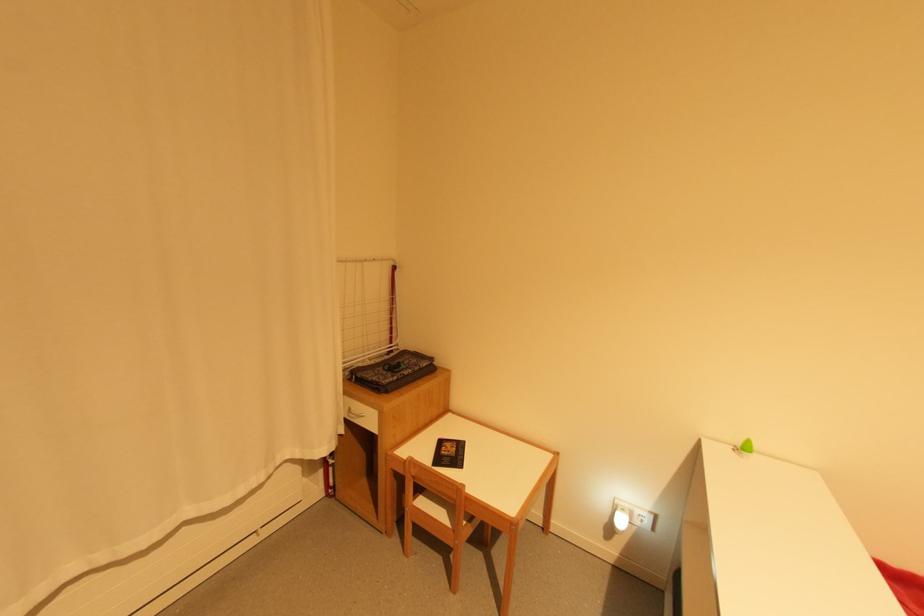
Find the location of a particular element. Image resolution: width=924 pixels, height=616 pixels. white drawer handle is located at coordinates (353, 413).